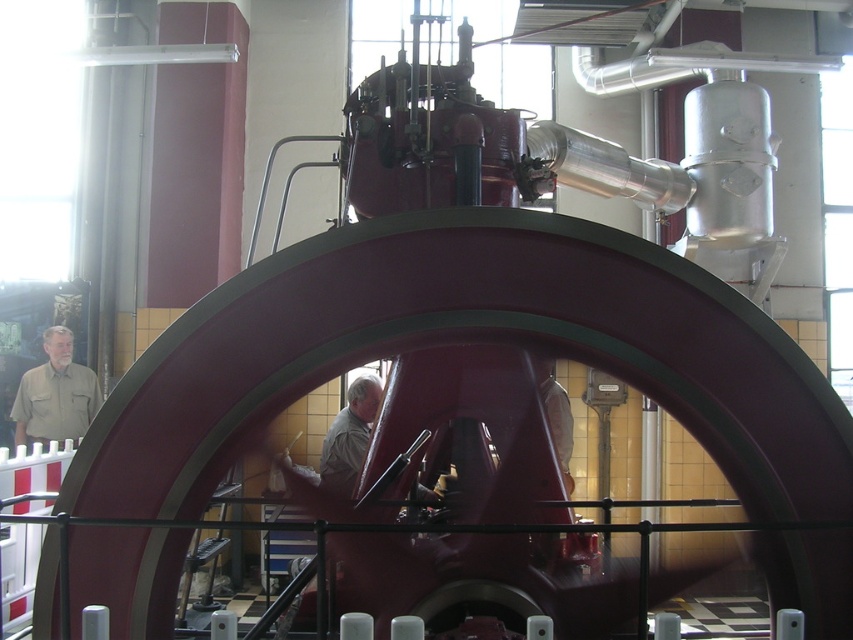
Is khaki shirt at left below light beige shirt at center?

No.

Which is more to the right, khaki shirt at left or light beige shirt at center?

Positioned to the right is light beige shirt at center.

Find the location of a particular element. khaki shirt at left is located at coordinates (55, 394).